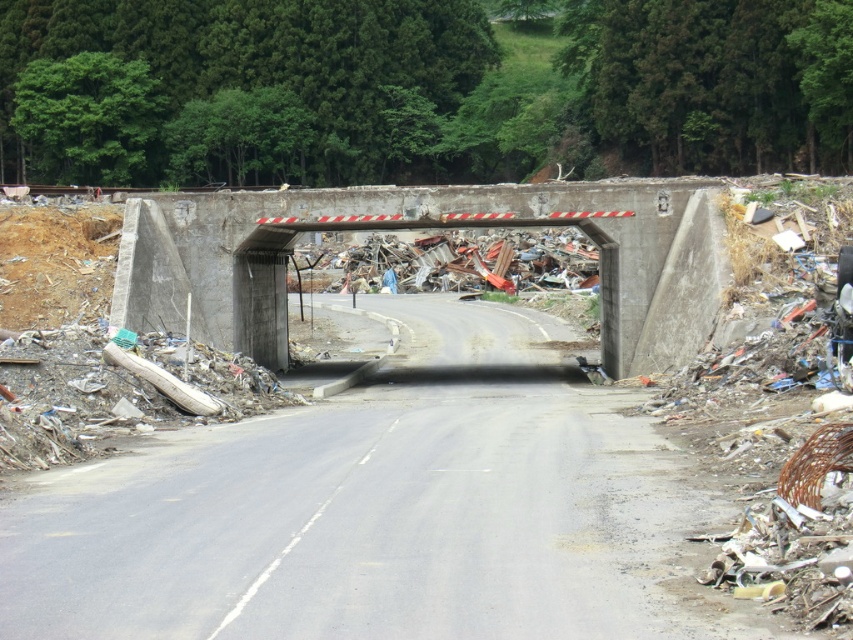
Is point (511, 468) farther from viewer compared to point (682, 344)?

No, it is not.

Does asphalt road at center come behind concrete bridge at center?

No.

Locate an element on the screen. asphalt road at center is located at coordinates (363, 524).

This screenshot has height=640, width=853. What are the coordinates of `asphalt road at center` in the screenshot? It's located at (363, 524).